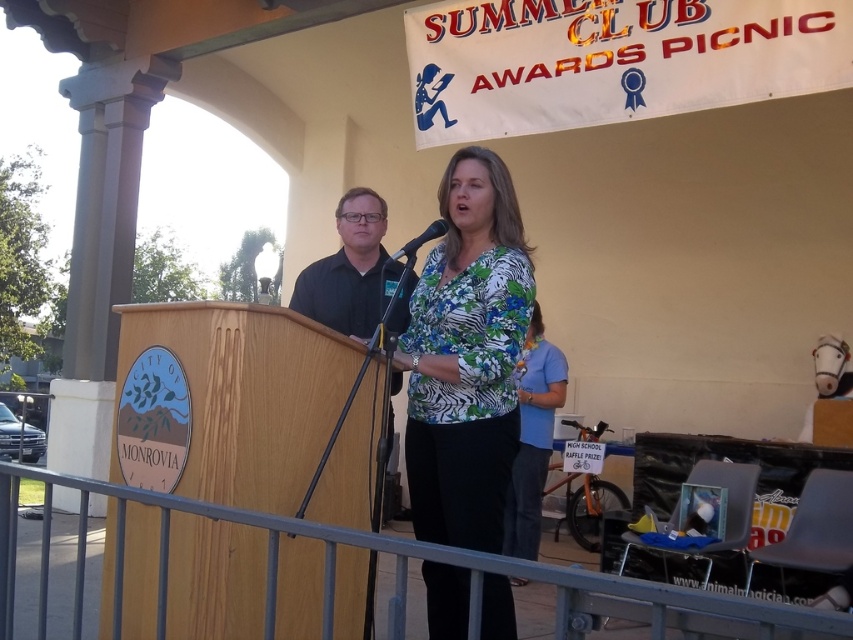
You are a photographer at the Awards Picnic and need to capture a clear shot of both the floral print blouse at center and the black plastic microphone at center. Which object should you focus on first to ensure it appears larger in your photo?

The floral print blouse at center is much taller than the black plastic microphone at center, so focusing on it first will ensure it appears larger in the photo.

From the picture: You are a photographer positioned behind the speaker at the Awards Picnic. You need to capture a closeup shot of the black smooth shirt at center and the black plastic microphone at center. What is the minimum distance you should set your camera lens to focus on to ensure both are in sharp focus?

The black smooth shirt at center and black plastic microphone at center are 19.03 inches apart, so the minimum focusing distance should be at least 19.03 inches to ensure both are in sharp focus.